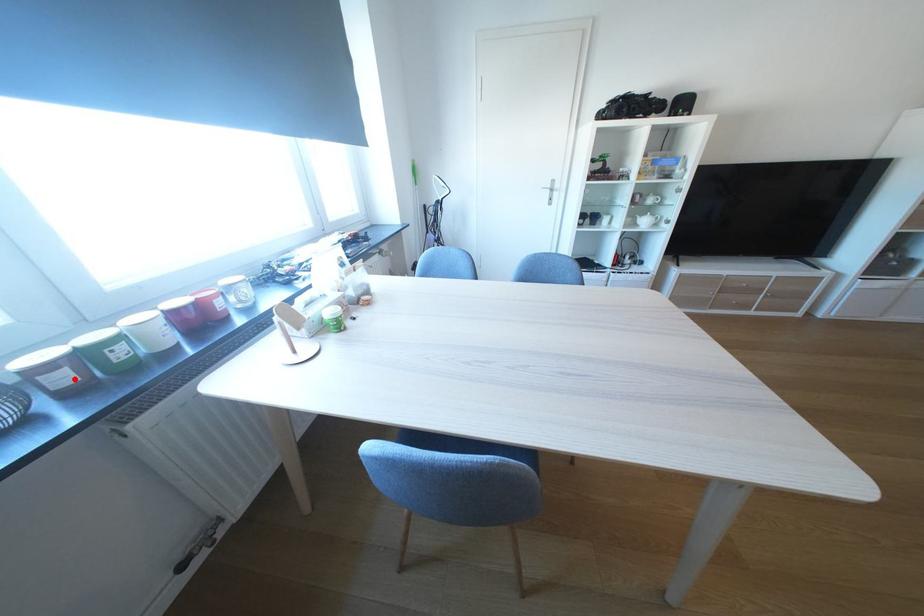
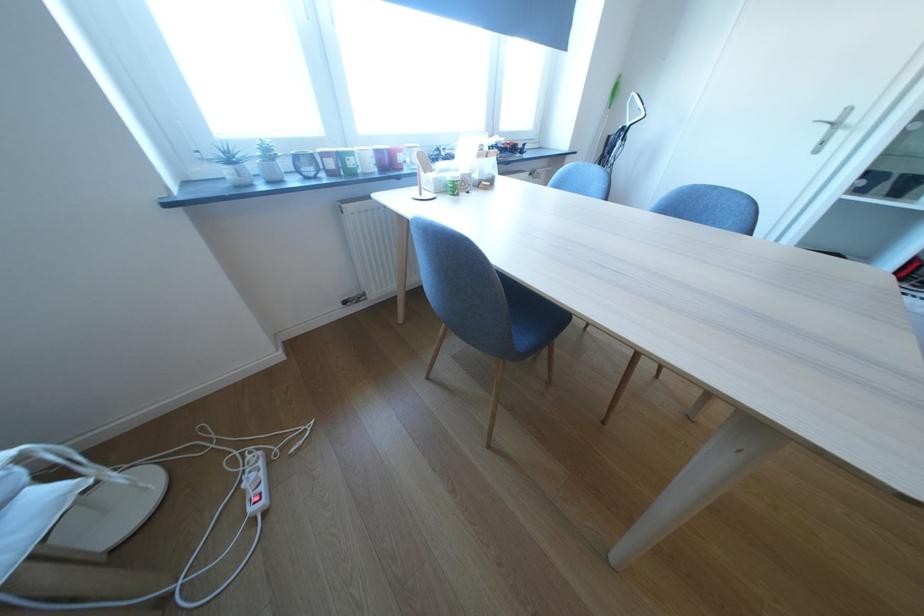
Question: I am providing you with two images of the same scene from different viewpoints. A red point is shown in image1. For the corresponding object point in image2, is it positioned nearer or farther from the camera?

Choices:
 (A) Nearer
 (B) Farther

Answer: (A)